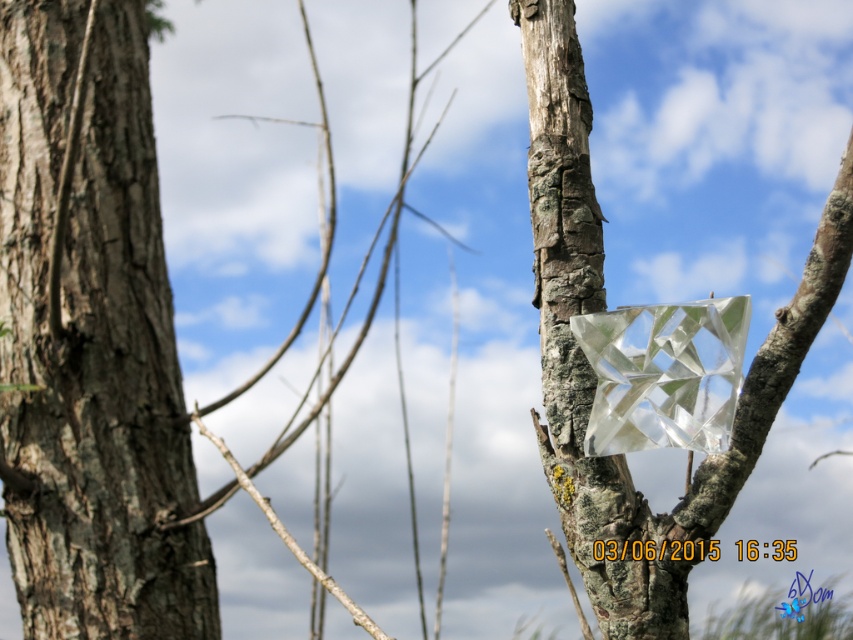
Between rough bark tree trunk at left and transparent glass cube at center, which one has less height?

With less height is transparent glass cube at center.

Can you confirm if rough bark tree trunk at left is positioned below transparent glass cube at center?

Yes, rough bark tree trunk at left is below transparent glass cube at center.

Does point (55, 440) lie in front of point (550, 88)?

No.

At what (x,y) coordinates should I click in order to perform the action: click on rough bark tree trunk at left. Please return your answer as a coordinate pair (x, y). The width and height of the screenshot is (853, 640). Looking at the image, I should click on (91, 342).